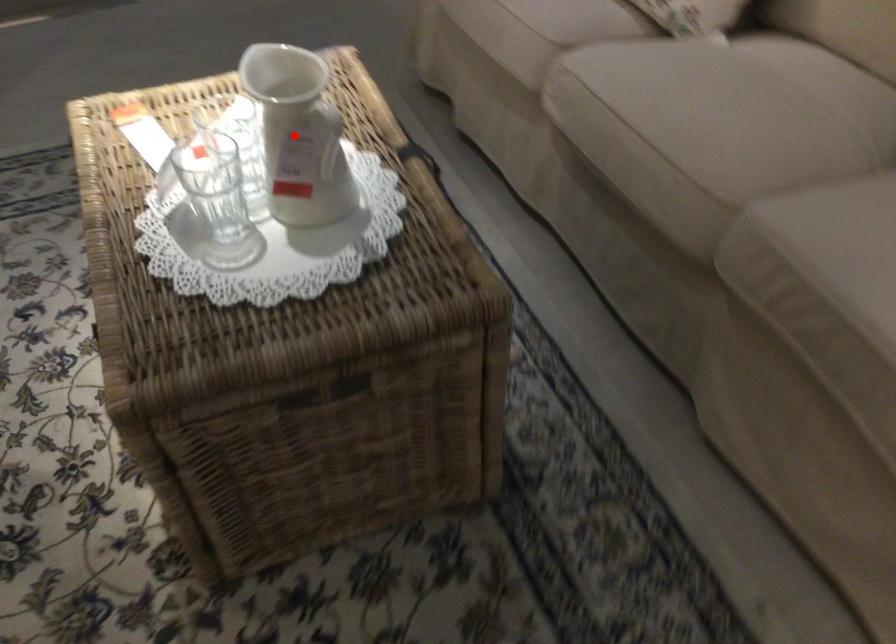
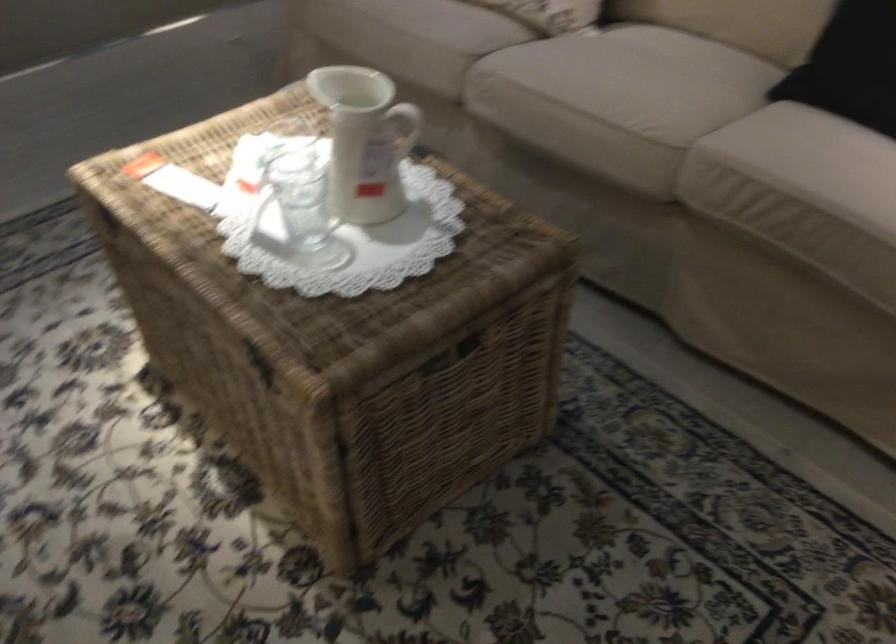
Question: I am providing you with two images of the same scene from different viewpoints. In image1, a red point is highlighted. Considering the same 3D point in image2, which of the following is correct?

Choices:
 (A) It is closer
 (B) It is farther

Answer: (B)